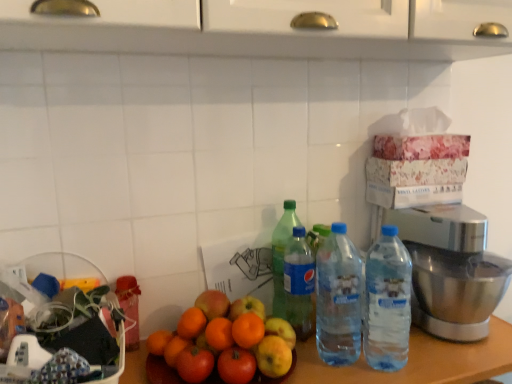
Where is `free space that is in between polished stainless steel mixer at right and clear plastic water bottles at center-right, the first bottle positioned from the right`? free space that is in between polished stainless steel mixer at right and clear plastic water bottles at center-right, the first bottle positioned from the right is located at coordinates (415, 348).